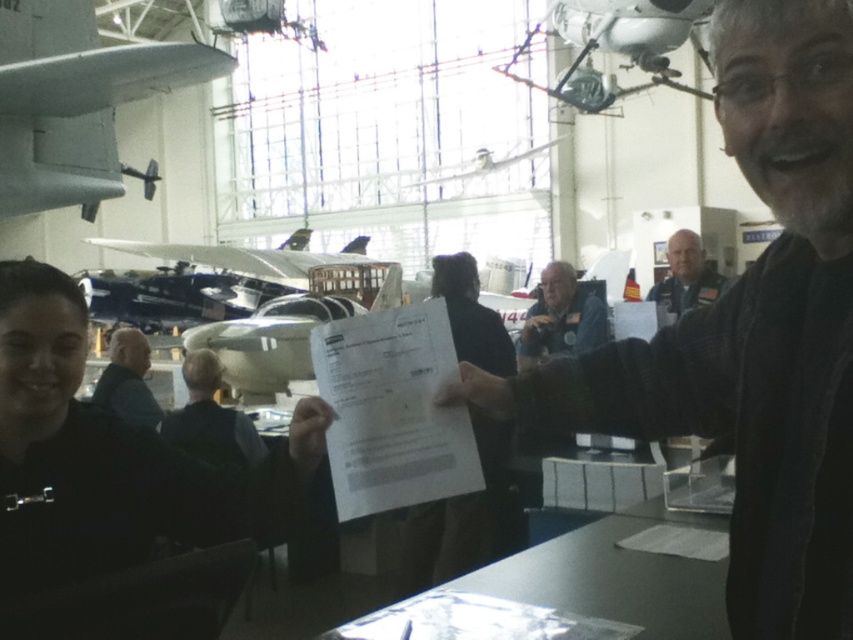
You are taking a photo of the aviation museum scene. The matte gray airplane wing at upper left and the white paper at center are both in your shot. Which object is positioned higher in the frame?

The matte gray airplane wing at upper left is located above the white paper at center, so it is positioned higher in the frame.